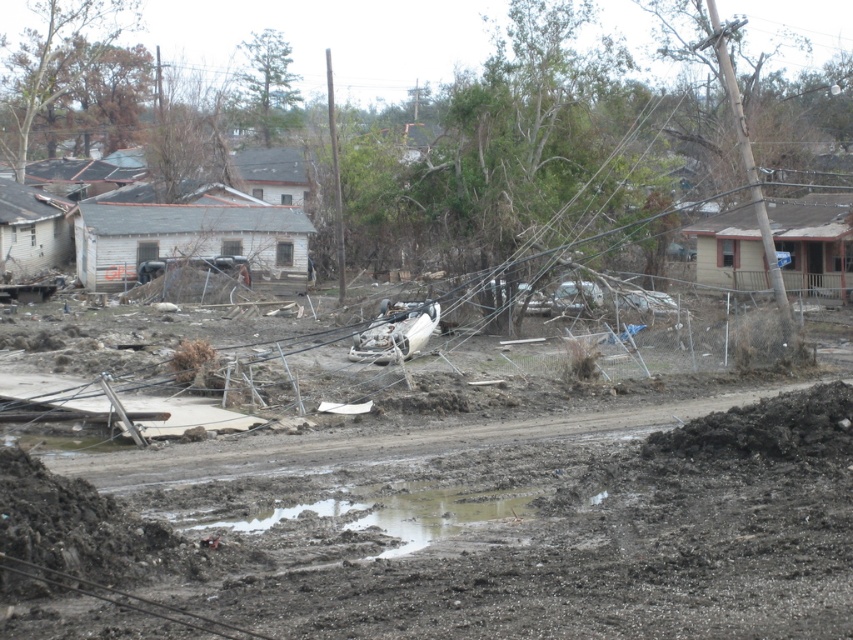
Based on the scene described, which object is located above the other? Please refer to the muddy soil at center and the muddy water at center in your answer.

The muddy soil at center is positioned over the muddy water at center, meaning the soil is above the water.

You are a rescue worker trying to navigate to the flooded area. You see the muddy soil at center. Where exactly is the muddy soil located in terms of coordinates?

The muddy soil at center is located at point (x=457, y=529).